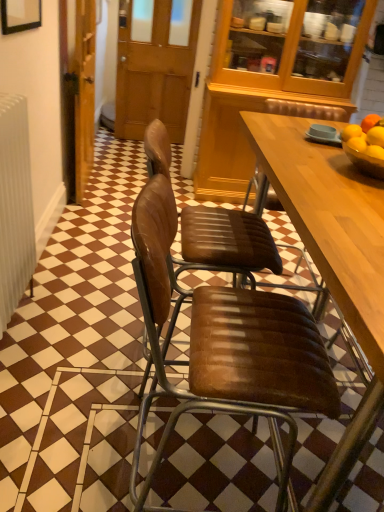
Question: Can you confirm if brown leather chair at center, positioned as the second chair in top-to-bottom order, is bigger than yellow matte/orange matte/orange bowl at right?

Choices:
 (A) no
 (B) yes

Answer: (B)

Question: From a real-world perspective, does brown leather chair at center, the 1th chair positioned from the bottom, stand above yellow matte/orange matte/orange bowl at right?

Choices:
 (A) yes
 (B) no

Answer: (B)

Question: Are brown leather chair at center, positioned as the second chair in top-to-bottom order, and yellow matte/orange matte/orange bowl at right making contact?

Choices:
 (A) no
 (B) yes

Answer: (A)

Question: Is brown leather chair at center, positioned as the second chair in top-to-bottom order, not near yellow matte/orange matte/orange bowl at right?

Choices:
 (A) no
 (B) yes

Answer: (A)

Question: Does brown leather chair at center, positioned as the second chair in top-to-bottom order, appear on the left side of yellow matte/orange matte/orange bowl at right?

Choices:
 (A) no
 (B) yes

Answer: (B)

Question: Is brown leather chair at center, positioned as the second chair in top-to-bottom order, positioned before yellow matte/orange matte/orange bowl at right?

Choices:
 (A) yes
 (B) no

Answer: (A)

Question: Is brown wooden door at center further to the viewer compared to wooden door at left?

Choices:
 (A) yes
 (B) no

Answer: (A)

Question: From a real-world perspective, is brown wooden door at center over wooden door at left?

Choices:
 (A) yes
 (B) no

Answer: (A)

Question: Considering the relative sizes of brown wooden door at center and wooden door at left in the image provided, is brown wooden door at center wider than wooden door at left?

Choices:
 (A) yes
 (B) no

Answer: (B)

Question: Is brown wooden door at center outside of wooden door at left?

Choices:
 (A) no
 (B) yes

Answer: (B)

Question: Is brown wooden door at center closer to camera compared to wooden door at left?

Choices:
 (A) no
 (B) yes

Answer: (A)

Question: Can you confirm if brown wooden door at center is thinner than wooden door at left?

Choices:
 (A) yes
 (B) no

Answer: (A)

Question: From a real-world perspective, is yellow matte/orange matte/orange bowl at right physically above brown wooden door at center?

Choices:
 (A) yes
 (B) no

Answer: (A)